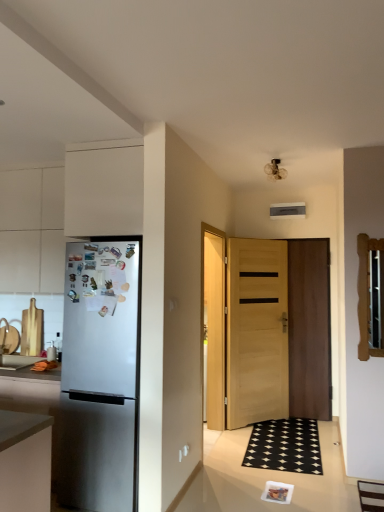
Question: Considering the relative sizes of light brown wooden door at center, which is the first door in left-to-right order, and satin silver refrigerator at left in the image provided, is light brown wooden door at center, which is the first door in left-to-right order, shorter than satin silver refrigerator at left?

Choices:
 (A) yes
 (B) no

Answer: (B)

Question: Are light brown wooden door at center, which is the first door in left-to-right order, and satin silver refrigerator at left beside each other?

Choices:
 (A) yes
 (B) no

Answer: (B)

Question: Can you confirm if light brown wooden door at center, positioned as the 2th door in right-to-left order, is positioned to the left of satin silver refrigerator at left?

Choices:
 (A) yes
 (B) no

Answer: (B)

Question: From the image's perspective, is light brown wooden door at center, positioned as the 2th door in right-to-left order, on satin silver refrigerator at left?

Choices:
 (A) no
 (B) yes

Answer: (B)

Question: Could you tell me if light brown wooden door at center, positioned as the 2th door in right-to-left order, is facing satin silver refrigerator at left?

Choices:
 (A) no
 (B) yes

Answer: (A)

Question: Is light brown wooden door at center, which is the first door in left-to-right order, facing away from satin silver refrigerator at left?

Choices:
 (A) yes
 (B) no

Answer: (B)

Question: Does matte gray countertop at left have a lesser width compared to satin silver refrigerator at left?

Choices:
 (A) no
 (B) yes

Answer: (B)

Question: Is matte gray countertop at left not near satin silver refrigerator at left?

Choices:
 (A) yes
 (B) no

Answer: (B)

Question: Can you confirm if matte gray countertop at left is positioned to the right of satin silver refrigerator at left?

Choices:
 (A) no
 (B) yes

Answer: (A)

Question: Considering the relative sizes of matte gray countertop at left and satin silver refrigerator at left in the image provided, is matte gray countertop at left wider than satin silver refrigerator at left?

Choices:
 (A) no
 (B) yes

Answer: (A)

Question: Is matte gray countertop at left oriented away from satin silver refrigerator at left?

Choices:
 (A) yes
 (B) no

Answer: (B)

Question: From the image's perspective, would you say matte gray countertop at left is positioned over satin silver refrigerator at left?

Choices:
 (A) no
 (B) yes

Answer: (A)

Question: From a real-world perspective, is wooden door at center, the 2th door when ordered from left to right, on matte gray countertop at left?

Choices:
 (A) yes
 (B) no

Answer: (A)